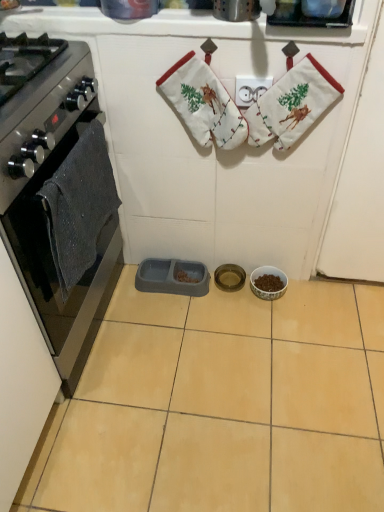
At what (x,y) coordinates should I click in order to perform the action: click on free space in front of gray plastic pet feeder at center, arranged as the 1th appliance when viewed from the left. Please return your answer as a coordinate pair (x, y). Looking at the image, I should click on (175, 317).